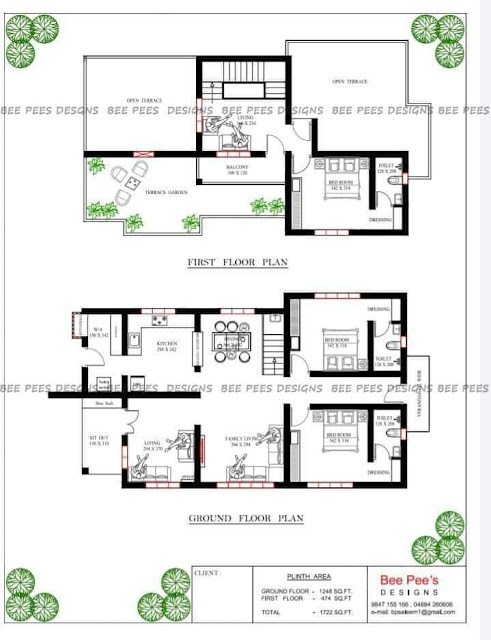
Identify the location of beds. The image size is (491, 640). (340, 175), (343, 342), (337, 436).